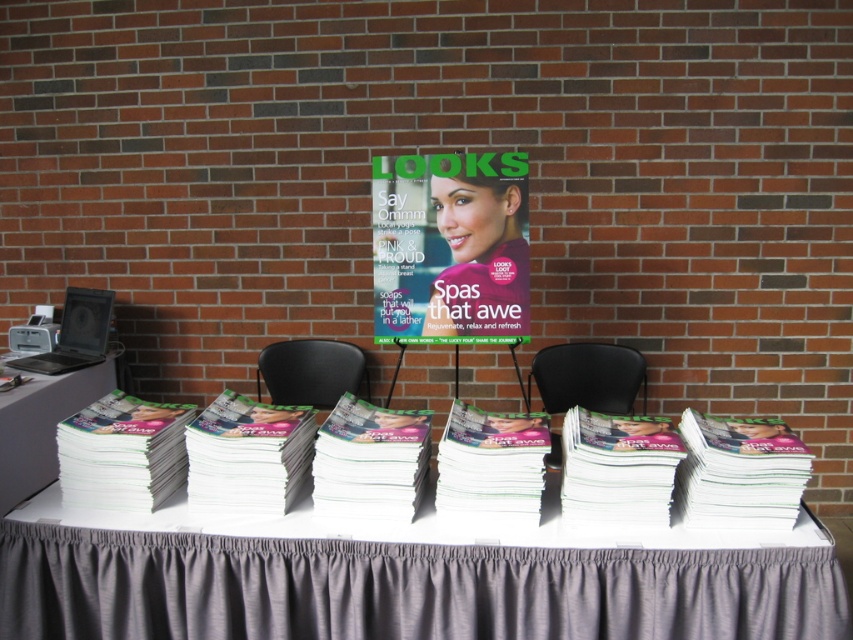
Question: Which is farther from the black leather chair at center?

Choices:
 (A) white plastic table at left
 (B) gray fabric tablecloth at center
 (C) black plastic chair at center
 (D) matte glossy magazine at center

Answer: (A)

Question: Is white plastic table at left below black leather chair at center?

Choices:
 (A) no
 (B) yes

Answer: (B)

Question: Can you confirm if matte glossy magazine at center is thinner than white plastic table at left?

Choices:
 (A) yes
 (B) no

Answer: (B)

Question: Which object is closer to the camera taking this photo?

Choices:
 (A) white plastic table at left
 (B) matte glossy magazine at center
 (C) gray fabric tablecloth at center

Answer: (C)

Question: Can you confirm if matte glossy magazine at center is smaller than white plastic table at left?

Choices:
 (A) no
 (B) yes

Answer: (B)

Question: Which object is positioned closest to the white plastic table at left?

Choices:
 (A) black leather chair at center
 (B) gray fabric tablecloth at center

Answer: (B)